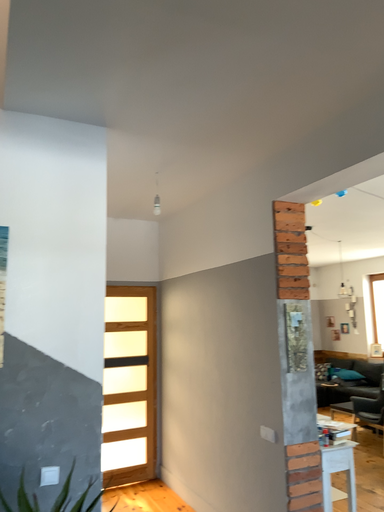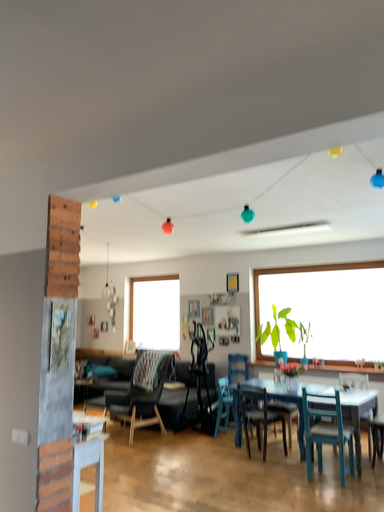
Question: How did the camera likely rotate when shooting the video?

Choices:
 (A) rotated right
 (B) rotated left

Answer: (A)